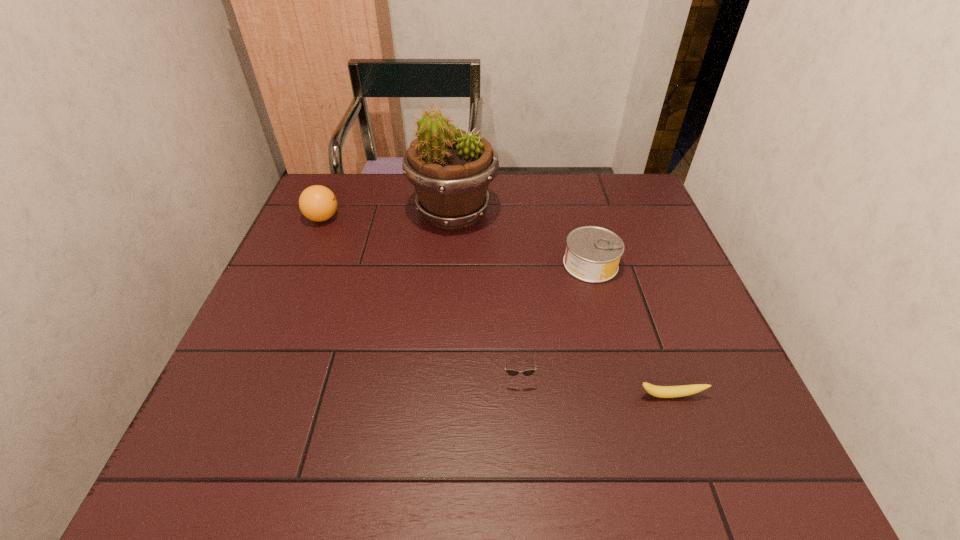
Identify the location of empty space that is in between the ping-pong ball and the banana. Image resolution: width=960 pixels, height=540 pixels. (496, 307).

Locate an element on the screen. vacant space that is in between the third nearest object and the leftmost object is located at coordinates (457, 241).

At what (x,y) coordinates should I click in order to perform the action: click on vacant region between the fourth farthest object and the can. Please return your answer as a coordinate pair (x, y). This screenshot has height=540, width=960. Looking at the image, I should click on (554, 320).

Locate an element on the screen. The image size is (960, 540). free space between the can and the leftmost object is located at coordinates (457, 241).

The image size is (960, 540). I want to click on blank region between the shortest object and the ping-pong ball, so pos(496,307).

Identify which object is the fourth closest to the nearest object. Please provide its 2D coordinates. Your answer should be formatted as a tuple, i.e. [(x, y)], where the tuple contains the x and y coordinates of a point satisfying the conditions above.

[(318, 203)]

Locate which object ranks second in proximity to the flowerpot. Please provide its 2D coordinates. Your answer should be formatted as a tuple, i.e. [(x, y)], where the tuple contains the x and y coordinates of a point satisfying the conditions above.

[(318, 203)]

The image size is (960, 540). Find the location of `free point that satisfies the following two spatial constraints: 1. on the front side of the third farthest object; 2. on the right side of the flowerpot`. free point that satisfies the following two spatial constraints: 1. on the front side of the third farthest object; 2. on the right side of the flowerpot is located at coordinates (449, 264).